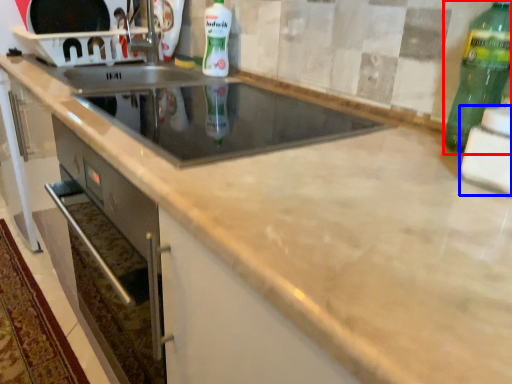
Question: Among these objects, which one is farthest to the camera, bottle (highlighted by a red box) or appliance (highlighted by a blue box)?

Choices:
 (A) bottle
 (B) appliance

Answer: (A)